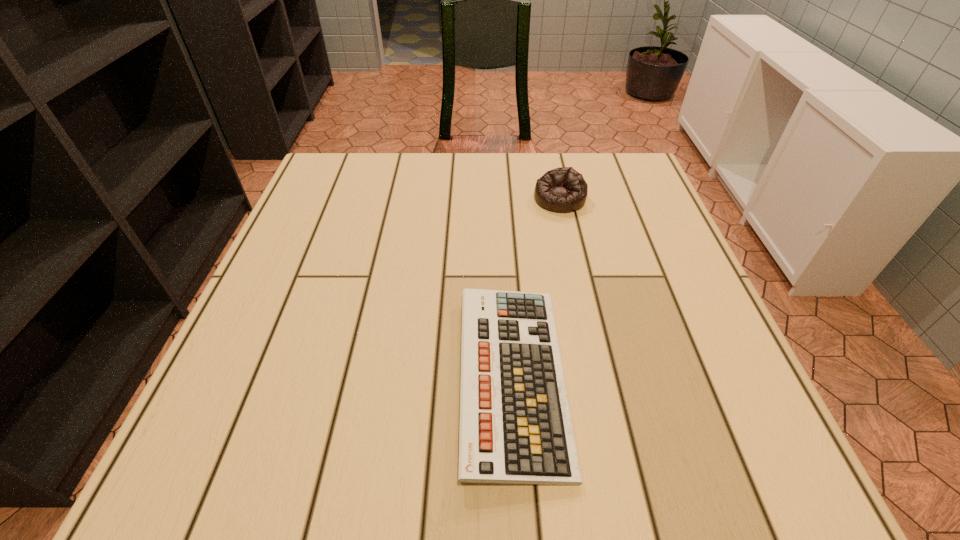
The image size is (960, 540). I want to click on the taller object, so [x=563, y=189].

The width and height of the screenshot is (960, 540). Find the location of `beanbag`. beanbag is located at coordinates 563,189.

The image size is (960, 540). I want to click on computer keyboard, so click(x=516, y=427).

Identify the location of the shorter object. (516, 427).

The image size is (960, 540). In order to click on vacant space located on the left of the beanbag in this screenshot , I will do `click(398, 199)`.

Where is `vacant space situated on the left of the nearer object`? vacant space situated on the left of the nearer object is located at coordinates (424, 377).

Where is `object located at the far edge`? object located at the far edge is located at coordinates (563, 189).

Locate an element on the screen. The width and height of the screenshot is (960, 540). object located at the near edge is located at coordinates (516, 427).

Locate an element on the screen. Image resolution: width=960 pixels, height=540 pixels. vacant space at the far edge is located at coordinates (396, 154).

In order to click on vacant space at the near edge of the desktop in this screenshot , I will do `click(332, 483)`.